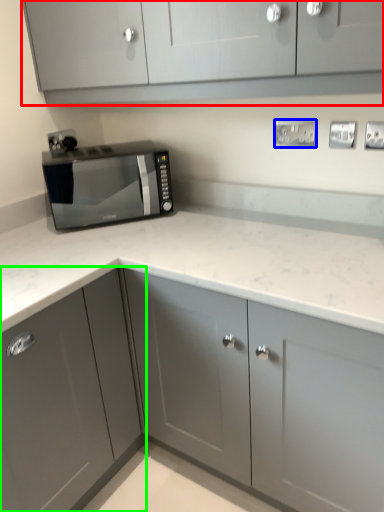
Question: Estimate the real-world distances between objects in this image. Which object is closer to cabinetry (highlighted by a red box), electric outlet (highlighted by a blue box) or cabinetry (highlighted by a green box)?

Choices:
 (A) electric outlet
 (B) cabinetry

Answer: (A)